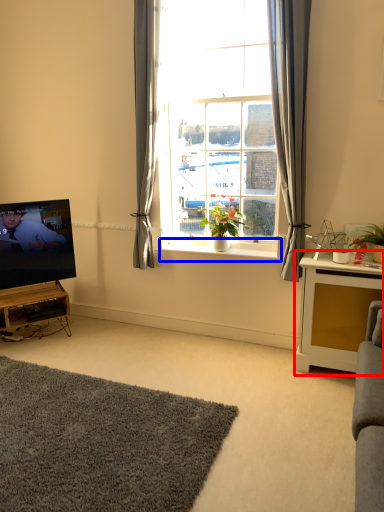
Question: Which of the following is the closest to the observer, table (highlighted by a red box) or window sill (highlighted by a blue box)?

Choices:
 (A) table
 (B) window sill

Answer: (A)